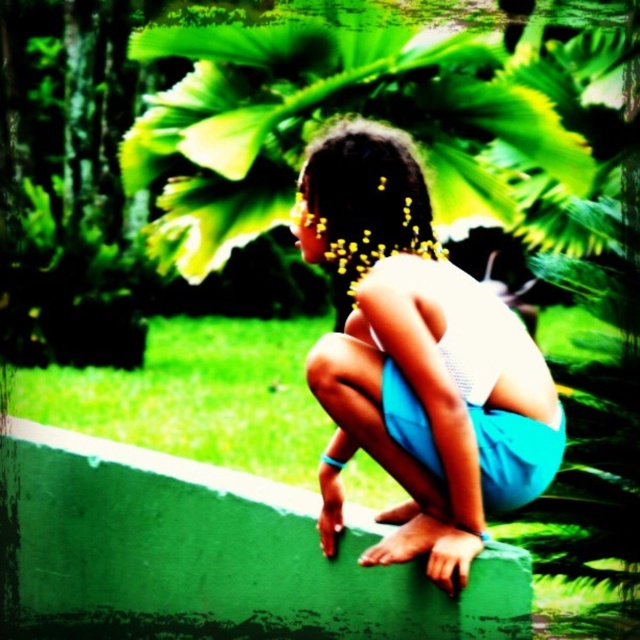
You are a photographer trying to capture the scene. You notice the white matte shorts at center and the dark brown hair at center. Which object is located to the right of the other?

The white matte shorts at center is positioned on the right side of dark brown hair at center.

You are a photographer trying to capture the white matte shorts at center and the dark brown hair at center in a single shot. Which object should you focus on first to ensure both are in focus?

You should focus on the white matte shorts at center first because it is closer to the viewer than the dark brown hair at center, so adjusting focus from near to far will help both be in focus.

You are standing in the outdoor scene and want to move from the point at coordinates point (376, 436) to the point at coordinates point (422, 204). Which direction should you face to move towards the second point?

To move from point (376, 436) to point (422, 204), you should face towards the northwest direction since point (422, 204) is located to the northwest of point (376, 436).